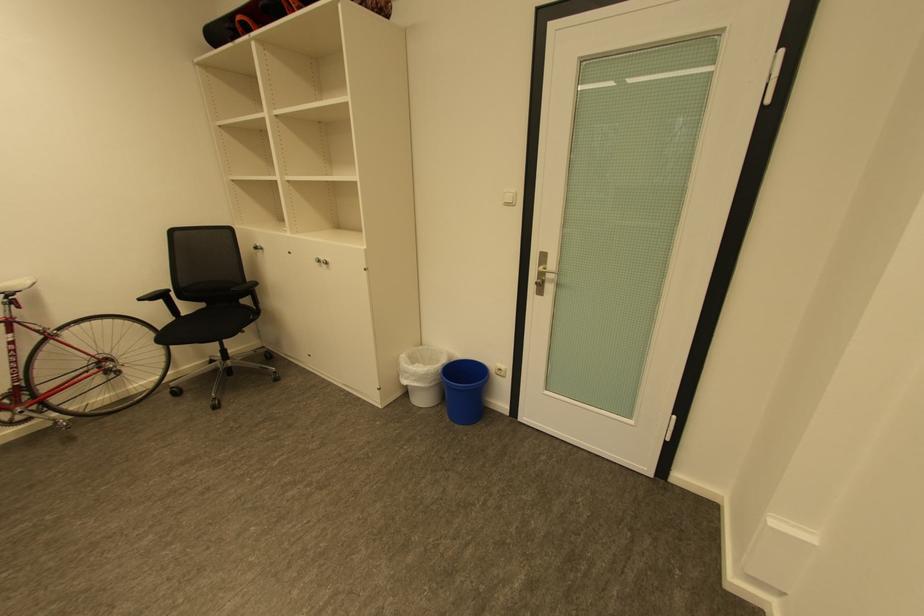
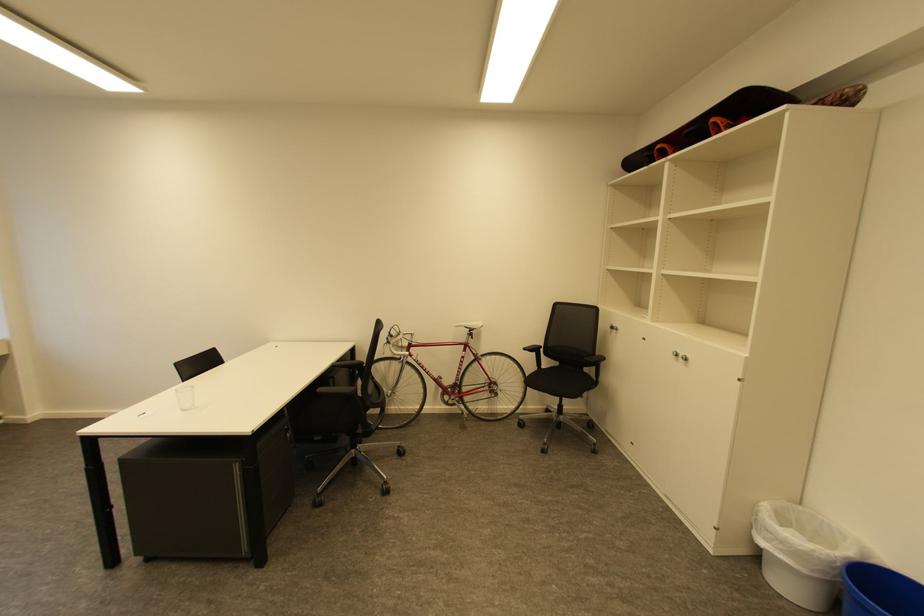
Question: The camera is either moving clockwise (left) or counter-clockwise (right) around the object. The first image is from the beginning of the video and the second image is from the end. Is the camera moving left or right when shooting the video?

Choices:
 (A) Left
 (B) Right

Answer: (B)